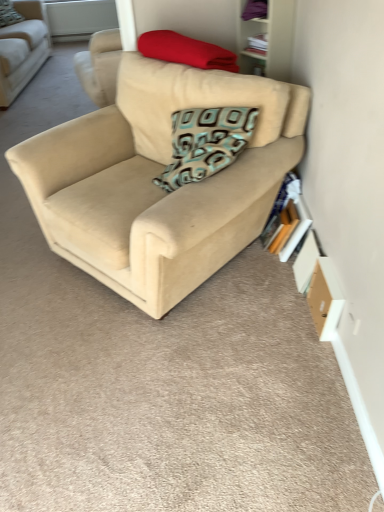
Question: Does teal patterned pillow at upper center, the first pillow from the back, have a greater width compared to beige fabric couch at center, the second studio couch from the back?

Choices:
 (A) no
 (B) yes

Answer: (A)

Question: Does teal patterned pillow at upper center, which is the 1th pillow from top to bottom, contain beige fabric couch at center, the second studio couch from the back?

Choices:
 (A) no
 (B) yes

Answer: (A)

Question: Can you confirm if teal patterned pillow at upper center, which is counted as the second pillow, starting from the right, is taller than beige fabric couch at center, marked as the 1th studio couch in a front-to-back arrangement?

Choices:
 (A) yes
 (B) no

Answer: (B)

Question: Is beige fabric couch at center, the first studio couch viewed from the right, at the back of teal patterned pillow at upper center, which ranks as the 2th pillow in front-to-back order?

Choices:
 (A) no
 (B) yes

Answer: (A)

Question: From the image's perspective, would you say teal patterned pillow at upper center, which is the 1th pillow from top to bottom, is shown under beige fabric couch at center, the second studio couch from the top?

Choices:
 (A) no
 (B) yes

Answer: (A)

Question: Relative to white plastic window screen at upper center, is wooden bookshelf at upper right in front or behind?

Choices:
 (A) front
 (B) behind

Answer: (A)

Question: Is point (243, 25) closer or farther from the camera than point (57, 14)?

Choices:
 (A) closer
 (B) farther

Answer: (A)

Question: Is wooden bookshelf at upper right bigger or smaller than white plastic window screen at upper center?

Choices:
 (A) small
 (B) big

Answer: (A)

Question: Considering the positions of wooden bookshelf at upper right and white plastic window screen at upper center in the image, is wooden bookshelf at upper right wider or thinner than white plastic window screen at upper center?

Choices:
 (A) wide
 (B) thin

Answer: (A)

Question: In the image, is matte red blanket at upper center, the 2th pillow in the left-to-right sequence, positioned in front of or behind wooden bookshelf at upper right?

Choices:
 (A) front
 (B) behind

Answer: (A)

Question: From a real-world perspective, is matte red blanket at upper center, marked as the 2th pillow in a top-to-bottom arrangement, positioned above or below wooden bookshelf at upper right?

Choices:
 (A) below
 (B) above

Answer: (B)

Question: Visually, is matte red blanket at upper center, which ranks as the first pillow in bottom-to-top order, positioned to the left or to the right of wooden bookshelf at upper right?

Choices:
 (A) right
 (B) left

Answer: (B)

Question: In terms of width, does matte red blanket at upper center, the 2th pillow in the left-to-right sequence, look wider or thinner when compared to wooden bookshelf at upper right?

Choices:
 (A) wide
 (B) thin

Answer: (A)

Question: From their relative heights in the image, would you say hardcover book at right is taller or shorter than teal patterned pillow at upper center, positioned as the second pillow in bottom-to-top order?

Choices:
 (A) short
 (B) tall

Answer: (A)

Question: Considering the positions of point (273, 229) and point (6, 18), is point (273, 229) closer or farther from the camera than point (6, 18)?

Choices:
 (A) closer
 (B) farther

Answer: (A)